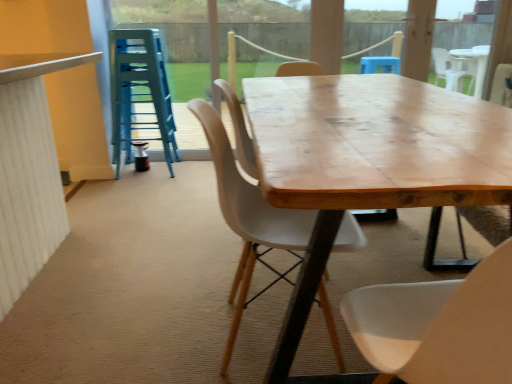
This screenshot has height=384, width=512. Describe the element at coordinates (139, 92) in the screenshot. I see `blue plastic stool at left` at that location.

The image size is (512, 384). I want to click on transparent glass door at upper center, so click(x=170, y=26).

Describe the element at coordinates (249, 220) in the screenshot. I see `wooden chair at center` at that location.

Identify the location of blue plastic stool at left. (139, 92).

Which of these two, wooden chair at center or wooden table at center, is smaller?

With smaller size is wooden chair at center.

You are a GUI agent. You are given a task and a screenshot of the screen. Output one action in this format:
    pyautogui.click(x=<x>, y=<y>)
    Task: Click on the desk that is on the right side of wooden chair at center
    The image size is (512, 384).
    Given the screenshot: What is the action you would take?
    click(x=368, y=162)

Is wooden chair at center far from wooden table at center?

wooden chair at center is near wooden table at center, not far away.

Which object is more forward, wooden chair at center or wooden table at center?

wooden table at center is closer to the camera.

Where is `glass door behind the wooden table at center`? The width and height of the screenshot is (512, 384). glass door behind the wooden table at center is located at coordinates pos(170,26).

Is wooden table at center completely or partially outside of transparent glass door at upper center?

Indeed, wooden table at center is completely outside transparent glass door at upper center.

From a real-world perspective, is wooden table at center on top of transparent glass door at upper center?

No, from a real-world perspective, wooden table at center is not on top of transparent glass door at upper center.

Is there a large distance between blue plastic stool at left and transparent glass door at upper center?

That's not correct — blue plastic stool at left is a little close to transparent glass door at upper center.

Considering the positions of objects blue plastic stool at left and transparent glass door at upper center in the image provided, who is more to the right, blue plastic stool at left or transparent glass door at upper center?

transparent glass door at upper center is more to the right.

Is the position of blue plastic stool at left less distant than that of transparent glass door at upper center?

Yes, it is.

Could you tell me if blue plastic stool at left is turned towards transparent glass door at upper center?

No, blue plastic stool at left is not aimed at transparent glass door at upper center.

Is wooden table at center touching wooden chair at center?

No, wooden table at center is not touching wooden chair at center.

Considering the points (453, 185) and (342, 243), which point is in front, point (453, 185) or point (342, 243)?

The point (453, 185) is in front.

Does wooden table at center have a greater height compared to wooden chair at center?

No, wooden table at center is not taller than wooden chair at center.

Measure the distance between wooden table at center and blue plastic stool at left.

wooden table at center is 1.65 meters away from blue plastic stool at left.

Does wooden table at center come behind blue plastic stool at left?

No, wooden table at center is closer to the camera.

Considering the relative sizes of wooden table at center and blue plastic stool at left in the image provided, is wooden table at center wider than blue plastic stool at left?

Indeed, wooden table at center has a greater width compared to blue plastic stool at left.

Can you tell me how much wooden table at center and blue plastic stool at left differ in facing direction?

The angle between the facing direction of wooden table at center and the facing direction of blue plastic stool at left is 177 degrees.

Considering the relative sizes of wooden chair at center and transparent glass door at upper center in the image provided, is wooden chair at center shorter than transparent glass door at upper center?

Indeed, wooden chair at center has a lesser height compared to transparent glass door at upper center.

Visually, is wooden chair at center positioned to the left or to the right of transparent glass door at upper center?

Clearly, wooden chair at center is on the right of transparent glass door at upper center in the image.

Which is closer, (x=213, y=112) or (x=398, y=25)?

The point (x=213, y=112) is in front.

Considering the points (246, 51) and (454, 168), which point is behind, point (246, 51) or point (454, 168)?

Positioned behind is point (246, 51).

Is transparent glass door at upper center facing away from wooden table at center?

transparent glass door at upper center does not have its back to wooden table at center.

From a real-world perspective, which is physically above, transparent glass door at upper center or wooden table at center?

transparent glass door at upper center.

You are a GUI agent. You are given a task and a screenshot of the screen. Output one action in this format:
    pyautogui.click(x=<x>, y=<y>)
    Task: Click on the chair below the wooden table at center (from the image's perspective)
    
    Given the screenshot: What is the action you would take?
    pyautogui.click(x=249, y=220)

The image size is (512, 384). I want to click on glass door above the wooden table at center (from a real-world perspective), so click(x=170, y=26).

Estimate the real-world distances between objects in this image. Which object is closer to transparent glass door at upper center, wooden chair at center or blue plastic stool at left?

blue plastic stool at left is closer to transparent glass door at upper center.

Estimate the real-world distances between objects in this image. Which object is further from transparent glass door at upper center, blue plastic stool at left or wooden chair at center?

Based on the image, wooden chair at center appears to be further to transparent glass door at upper center.

Considering their positions, is transparent glass door at upper center positioned closer to wooden table at center than blue plastic stool at left?

blue plastic stool at left.

Which object lies nearer to the anchor point transparent glass door at upper center, blue plastic stool at left or wooden table at center?

blue plastic stool at left.

Which object lies nearer to the anchor point transparent glass door at upper center, wooden table at center or blue plastic stool at left?

blue plastic stool at left is closer to transparent glass door at upper center.

Looking at the image, which one is located further to wooden chair at center, transparent glass door at upper center or blue plastic stool at left?

Based on the image, transparent glass door at upper center appears to be further to wooden chair at center.

From the image, which object appears to be farther from transparent glass door at upper center, wooden table at center or wooden chair at center?

wooden chair at center is positioned further to the anchor transparent glass door at upper center.

Based on their spatial positions, is transparent glass door at upper center or wooden chair at center further from wooden table at center?

Among the two, transparent glass door at upper center is located further to wooden table at center.

The height and width of the screenshot is (384, 512). I want to click on stool between wooden chair at center and transparent glass door at upper center in the front-back direction, so click(x=139, y=92).

Image resolution: width=512 pixels, height=384 pixels. Find the location of `stool between wooden table at center and transparent glass door at upper center from front to back`. stool between wooden table at center and transparent glass door at upper center from front to back is located at coordinates (139, 92).

What are the coordinates of `chair between wooden table at center and transparent glass door at upper center along the z-axis` in the screenshot? It's located at (249, 220).

Identify the location of chair positioned between wooden table at center and blue plastic stool at left from near to far. The height and width of the screenshot is (384, 512). (249, 220).